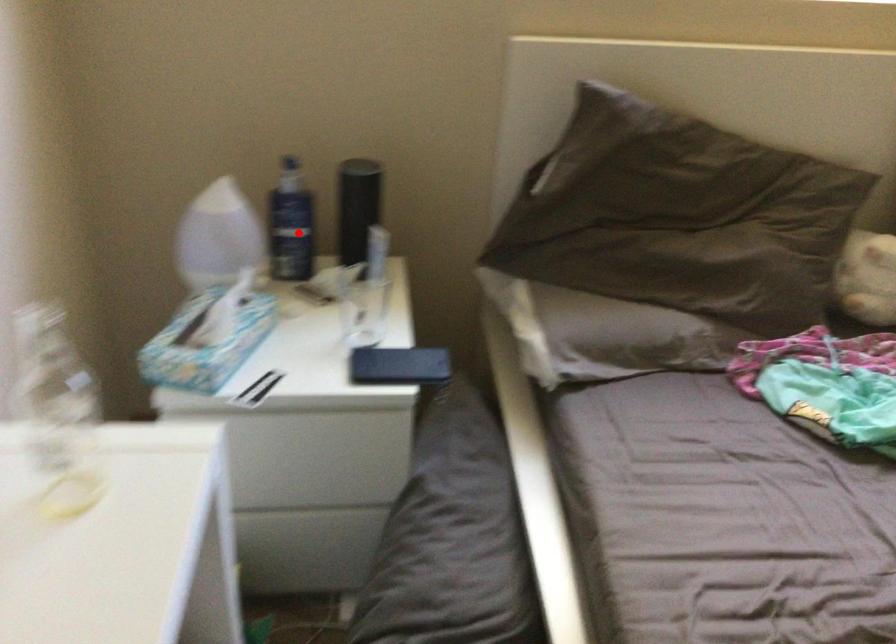
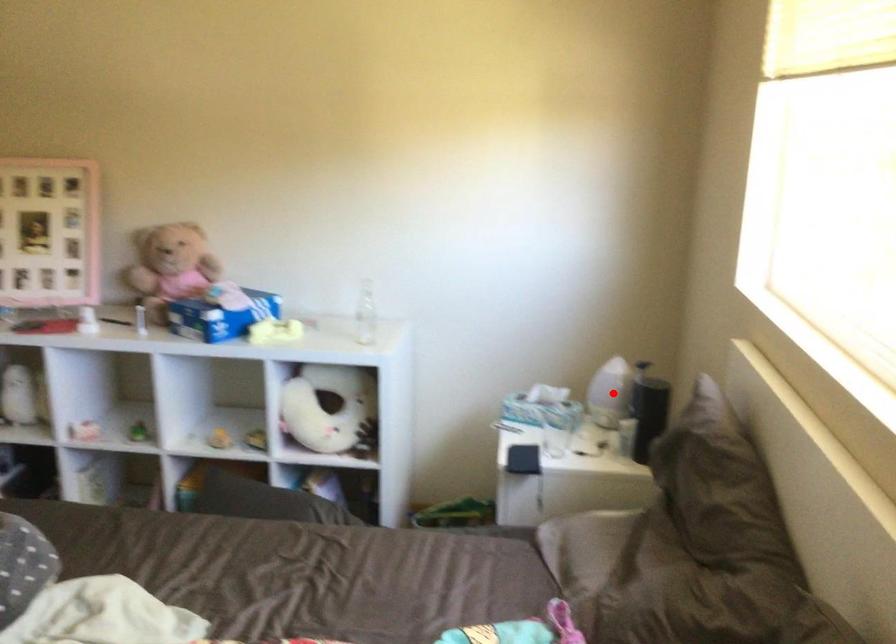
I am providing you with two images of the same scene from different viewpoints. A red point is marked on the first image and another point is marked on the second image. Do the highlighted points in image1 and image2 indicate the same real-world spot?

Yes